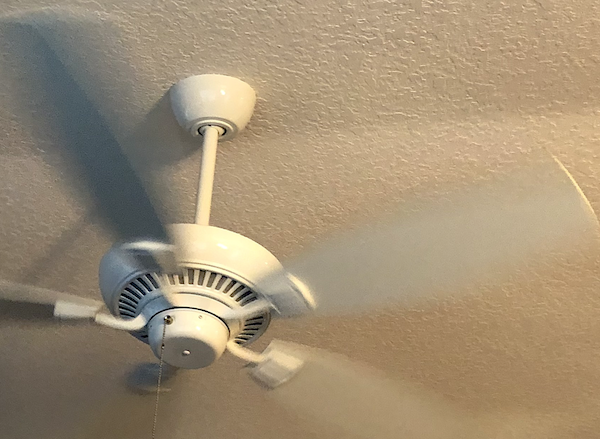
You are a GUI agent. You are given a task and a screenshot of the screen. Output one action in this format:
    pyautogui.click(x=<x>, y=<y>)
    Task: Click on the spinning ceiling fan
    The height and width of the screenshot is (439, 600).
    Given the screenshot: What is the action you would take?
    pyautogui.click(x=227, y=251)